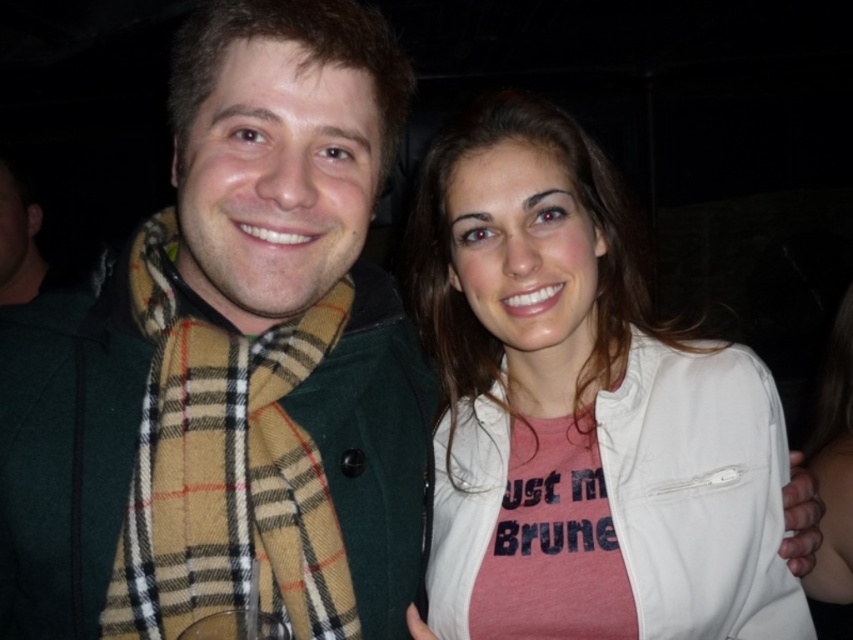
You are a photographer trying to focus on the smooth white shirt at center in the image. Which direction should you adjust your camera to ensure the green wool scarf at center is also in the frame?

The green wool scarf at center is positioned on the left side of the smooth white shirt at center. To include both in the frame, adjust the camera slightly to the left.

You are a photographer adjusting the lighting for a portrait. You notice the green wool scarf at center and the smooth white shirt at center. Which item is closer to the camera lens?

The green wool scarf at center is positioned over the smooth white shirt at center, so it is closer to the camera lens.

You are standing in front of the two people in the image. You want to place a small gift exactly at the position of point (445, 524) and another gift at point (843, 497). Which gift would be closer to you?

The gift placed at point (445, 524) is closer to you because it is in front of point (843, 497).